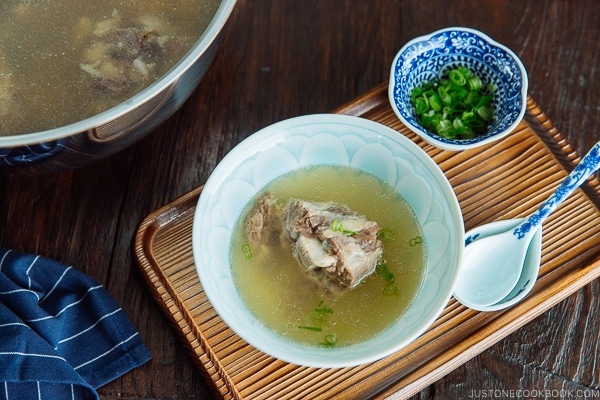
At what (x,y) coordinates should I click in order to perform the action: click on brown wood table. Please return your answer as a coordinate pair (x, y). The height and width of the screenshot is (400, 600). Looking at the image, I should click on (330, 65).